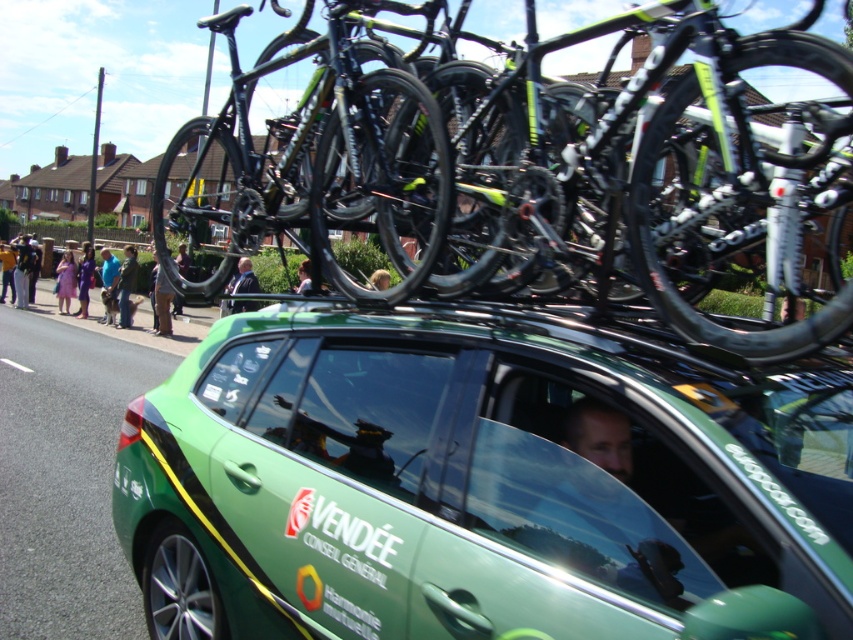
Question: Can you confirm if purple fabric dress at lower left is bigger than brown fabric pants at center?

Choices:
 (A) no
 (B) yes

Answer: (B)

Question: Estimate the real-world distances between objects in this image. Which object is farther from the dark gray jacket at center?

Choices:
 (A) light purple dress at lower left
 (B) shiny black bike at center
 (C) purple fabric dress at lower left
 (D) blue denim jeans at lower left

Answer: (B)

Question: Estimate the real-world distances between objects in this image. Which object is closer to the shiny black bike at center?

Choices:
 (A) green matte car at center
 (B) dark blue jeans at center
 (C) light purple dress at lower left
 (D) purple fabric dress at lower left

Answer: (A)

Question: Is the position of smooth skin face at center more distant than that of purple fabric dress at lower left?

Choices:
 (A) no
 (B) yes

Answer: (A)

Question: Which of these objects is positioned closest to the green matte car at center?

Choices:
 (A) purple fabric dress at lower left
 (B) yellow jacket at left

Answer: (A)

Question: Can you confirm if brown fabric pants at center is positioned to the left of yellow jacket at left?

Choices:
 (A) yes
 (B) no

Answer: (B)